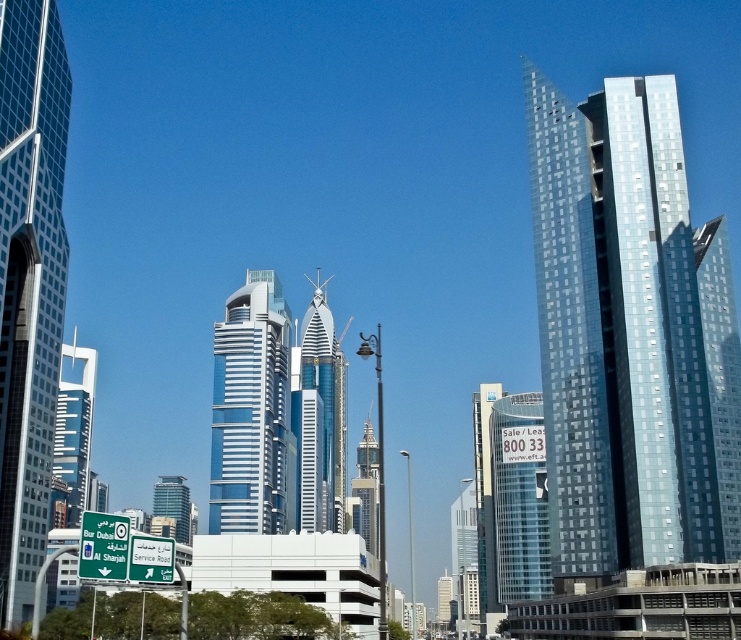
Between glassy silver skyscraper at center and glassy blue skyscraper at left, which one is positioned lower?

glassy silver skyscraper at center is lower down.

Does glassy silver skyscraper at center have a smaller size compared to glassy blue skyscraper at left?

Indeed, glassy silver skyscraper at center has a smaller size compared to glassy blue skyscraper at left.

Locate an element on the screen. The width and height of the screenshot is (741, 640). glassy silver skyscraper at center is located at coordinates (250, 410).

Is point (19, 595) in front of point (322, 429)?

Yes, point (19, 595) is in front of point (322, 429).

Image resolution: width=741 pixels, height=640 pixels. I want to click on glassy steel skyscraper at left, so click(x=29, y=284).

The height and width of the screenshot is (640, 741). In order to click on glassy steel skyscraper at left in this screenshot , I will do `click(29, 284)`.

The width and height of the screenshot is (741, 640). I want to click on glassy steel skyscraper at left, so click(x=29, y=284).

Is point (216, 454) in front of point (539, 524)?

No, it is behind (539, 524).

Which of these two, glassy silver skyscraper at center or transparent glass building at center, stands shorter?

transparent glass building at center

Describe the element at coordinates (250, 410) in the screenshot. I see `glassy silver skyscraper at center` at that location.

Locate an element on the screen. The height and width of the screenshot is (640, 741). glassy silver skyscraper at center is located at coordinates (250, 410).